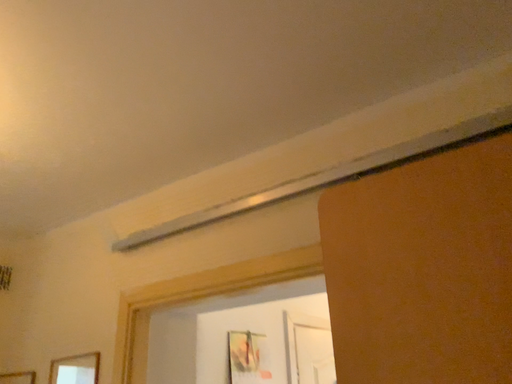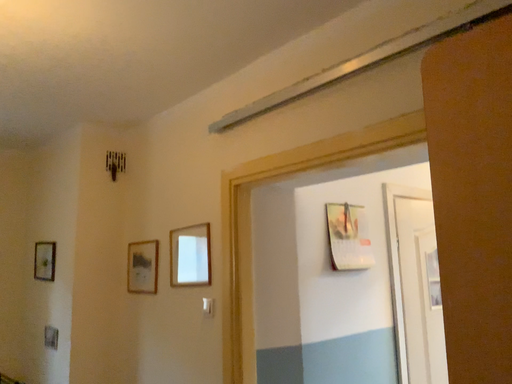
Question: How did the camera likely rotate when shooting the video?

Choices:
 (A) rotated right
 (B) rotated left

Answer: (B)